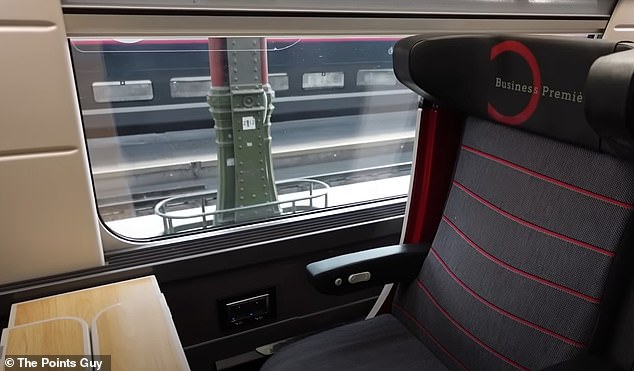
You are a GUI agent. You are given a task and a screenshot of the screen. Output one action in this format:
    pyautogui.click(x=<x>, y=<y>)
    Task: Click on the window
    
    Given the screenshot: What is the action you would take?
    pyautogui.click(x=333, y=125)